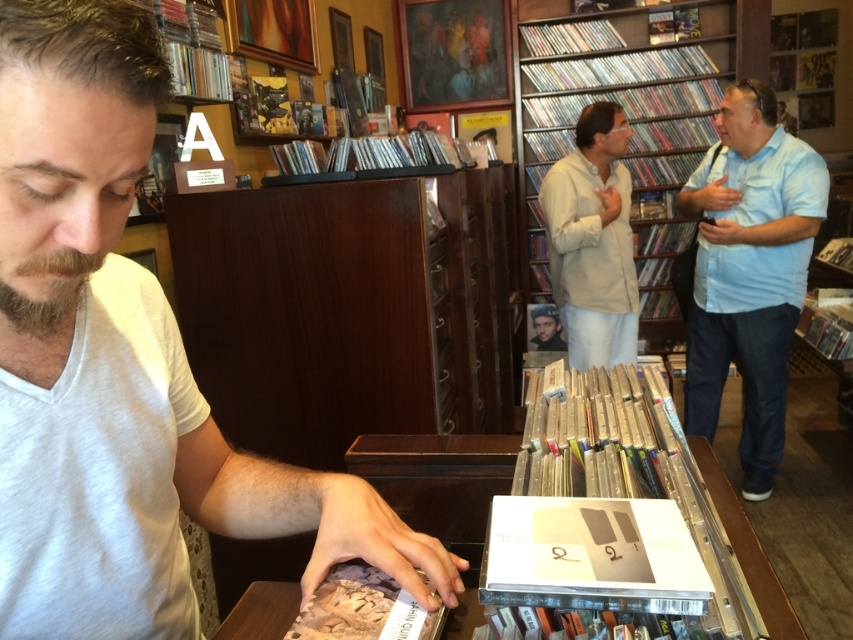
In the music store scene, you see a beige cotton shirt at center and a brown fuzzy beard at lower left. Which of these two items is located to the right when viewed from the front?

The beige cotton shirt at center is positioned on the right side of brown fuzzy beard at lower left, so it is located to the right when viewed from the front.